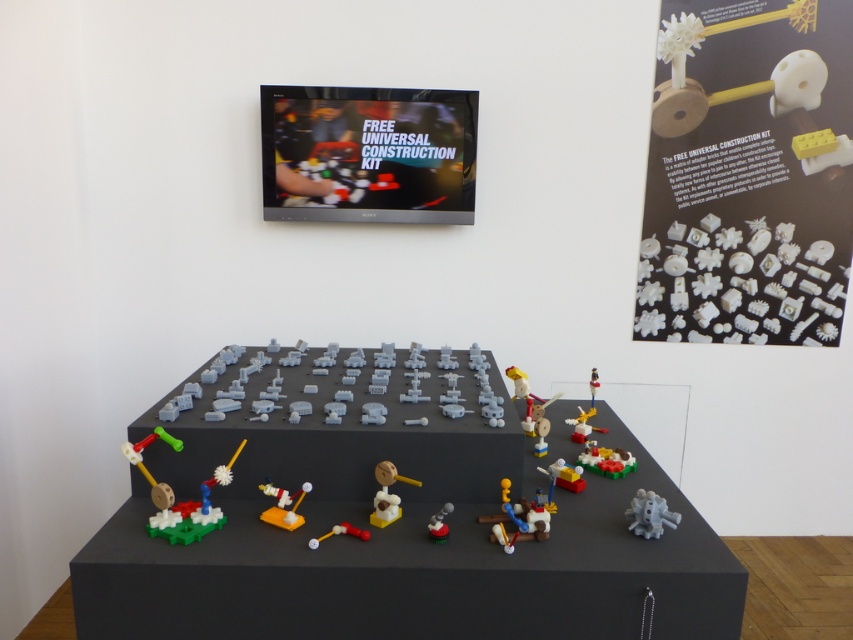
You are an engineer designing a new construction kit. You have two pieces available in the scene, the gray matte octopus at lower right and the translucent yellow rod at center. Which piece is bigger in size?

The gray matte octopus at lower right is larger in size compared to the translucent yellow rod at center.

Looking at this image, you are standing in front of the display setup and want to locate the gray matte octopus at lower right. Based on the coordinate system where the bottom left corner is the origin, can you tell me its approximate position?

The gray matte octopus at lower right is located at the 2D coordinates of approximately 0.805 on the x axis and 0.763 on the y axis.